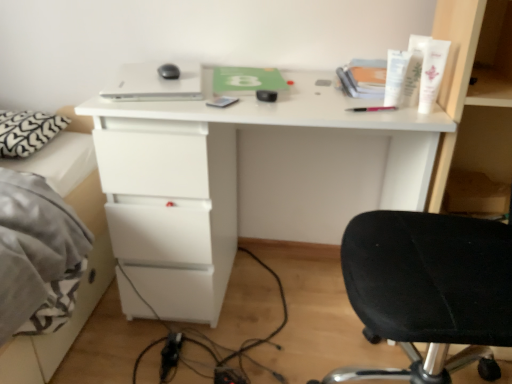
Locate an element on the screen. The width and height of the screenshot is (512, 384). vacant space to the left of white cream tube at upper right, the 3th toiletry positioned from the right is located at coordinates (329, 107).